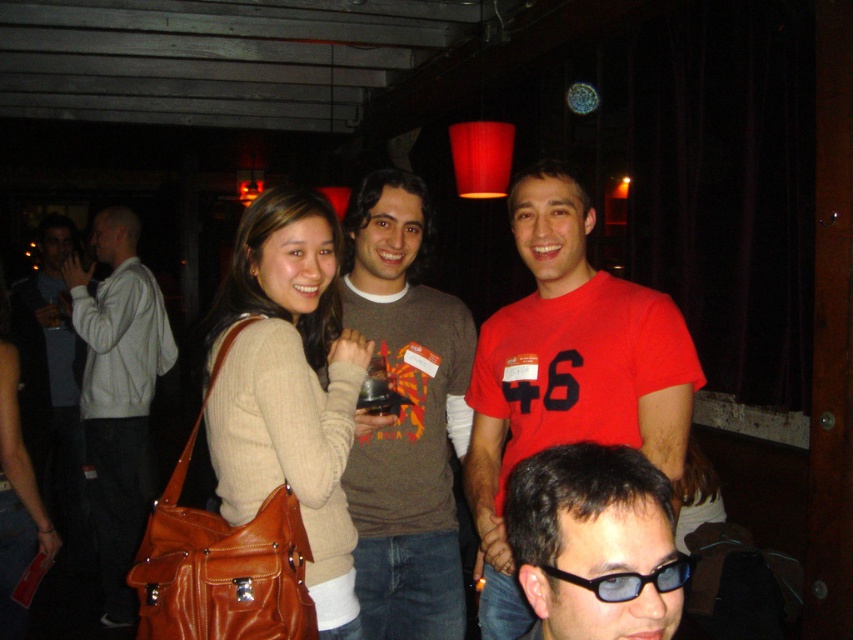
Does point (296, 227) lie in front of point (657, 634)?

No, it is behind (657, 634).

This screenshot has width=853, height=640. Describe the element at coordinates (289, 387) in the screenshot. I see `matte beige sweater at center` at that location.

The height and width of the screenshot is (640, 853). Describe the element at coordinates (289, 387) in the screenshot. I see `matte beige sweater at center` at that location.

This screenshot has height=640, width=853. I want to click on matte beige sweater at center, so click(289, 387).

The image size is (853, 640). Describe the element at coordinates (566, 371) in the screenshot. I see `matte red t-shirt at center` at that location.

Is matte red t-shirt at center closer to camera compared to blue tinted glasses at center?

No, it is behind blue tinted glasses at center.

Where is `matte red t-shirt at center`? This screenshot has height=640, width=853. matte red t-shirt at center is located at coordinates (566, 371).

This screenshot has width=853, height=640. Find the location of `matte red t-shirt at center`. matte red t-shirt at center is located at coordinates (566, 371).

Looking at this image, is blue tinted glasses at center wider than white cotton hoodie at left?

Incorrect, blue tinted glasses at center's width does not surpass white cotton hoodie at left's.

Between blue tinted glasses at center and white cotton hoodie at left, which one appears on the right side from the viewer's perspective?

blue tinted glasses at center

This screenshot has height=640, width=853. I want to click on blue tinted glasses at center, so click(595, 541).